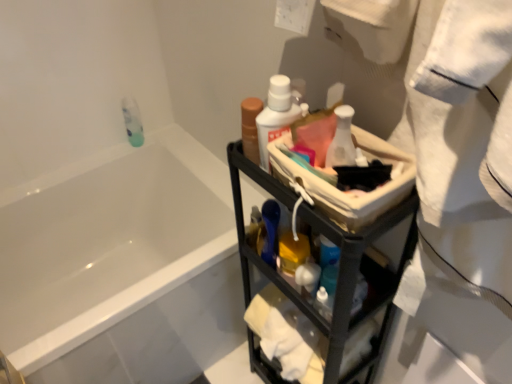
Question: Would you consider white glossy bathtub at upper left to be distant from black metal cart at center?

Choices:
 (A) no
 (B) yes

Answer: (A)

Question: Does white glossy bathtub at upper left have a lesser height compared to black metal cart at center?

Choices:
 (A) no
 (B) yes

Answer: (B)

Question: Would you say white glossy bathtub at upper left is outside black metal cart at center?

Choices:
 (A) yes
 (B) no

Answer: (A)

Question: From a real-world perspective, is white glossy bathtub at upper left beneath black metal cart at center?

Choices:
 (A) yes
 (B) no

Answer: (A)

Question: Is white glossy bathtub at upper left touching black metal cart at center?

Choices:
 (A) yes
 (B) no

Answer: (B)

Question: Is white glossy bathtub at upper left at the left side of black metal cart at center?

Choices:
 (A) no
 (B) yes

Answer: (B)

Question: Is white glossy bottle at upper center, which is the third mouthwash in left-to-right order, further to the viewer compared to translucent plastic mouthwash at upper left, positioned as the 1th mouthwash in left-to-right order?

Choices:
 (A) yes
 (B) no

Answer: (B)

Question: Does white glossy bottle at upper center, arranged as the 1th mouthwash when viewed from the right, have a lesser width compared to translucent plastic mouthwash at upper left, positioned as the 1th mouthwash in left-to-right order?

Choices:
 (A) no
 (B) yes

Answer: (A)

Question: Is white glossy bottle at upper center, which appears as the 3th mouthwash when viewed from the back, taller than translucent plastic mouthwash at upper left, positioned as the 1th mouthwash in left-to-right order?

Choices:
 (A) no
 (B) yes

Answer: (A)

Question: Considering the relative positions of white glossy bottle at upper center, arranged as the 1th mouthwash when viewed from the front, and translucent plastic mouthwash at upper left, positioned as the 1th mouthwash in left-to-right order, in the image provided, is white glossy bottle at upper center, arranged as the 1th mouthwash when viewed from the front, in front of translucent plastic mouthwash at upper left, positioned as the 1th mouthwash in left-to-right order,?

Choices:
 (A) no
 (B) yes

Answer: (B)

Question: From a real-world perspective, is white glossy bottle at upper center, which is the third mouthwash in left-to-right order, below translucent plastic mouthwash at upper left, which appears as the third mouthwash when viewed from the front?

Choices:
 (A) no
 (B) yes

Answer: (A)

Question: Can you confirm if white glossy bottle at upper center, arranged as the 1th mouthwash when viewed from the front, is smaller than translucent plastic mouthwash at upper left, which appears as the third mouthwash when viewed from the front?

Choices:
 (A) no
 (B) yes

Answer: (B)

Question: Can you see white glossy bottle at center touching black metal cart at center?

Choices:
 (A) no
 (B) yes

Answer: (A)